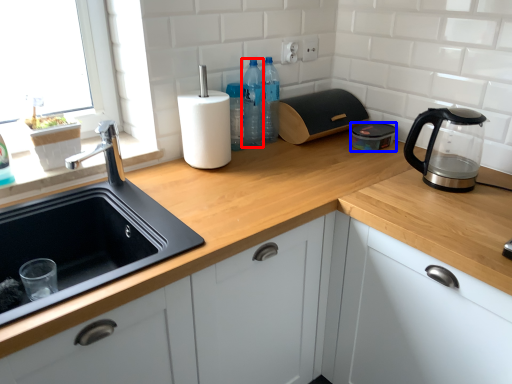
Question: Among these objects, which one is nearest to the camera, bottle (highlighted by a red box) or kitchen appliance (highlighted by a blue box)?

Choices:
 (A) bottle
 (B) kitchen appliance

Answer: (A)